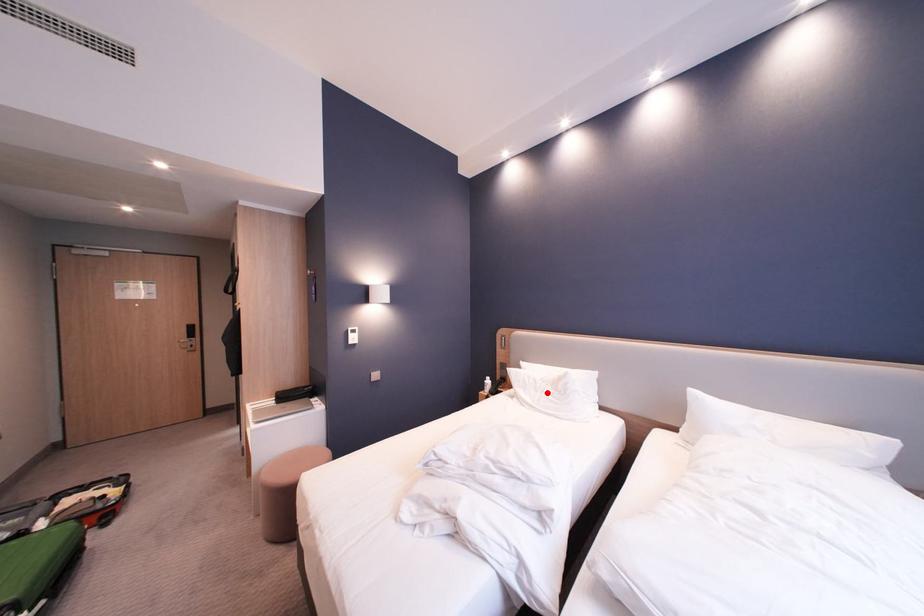
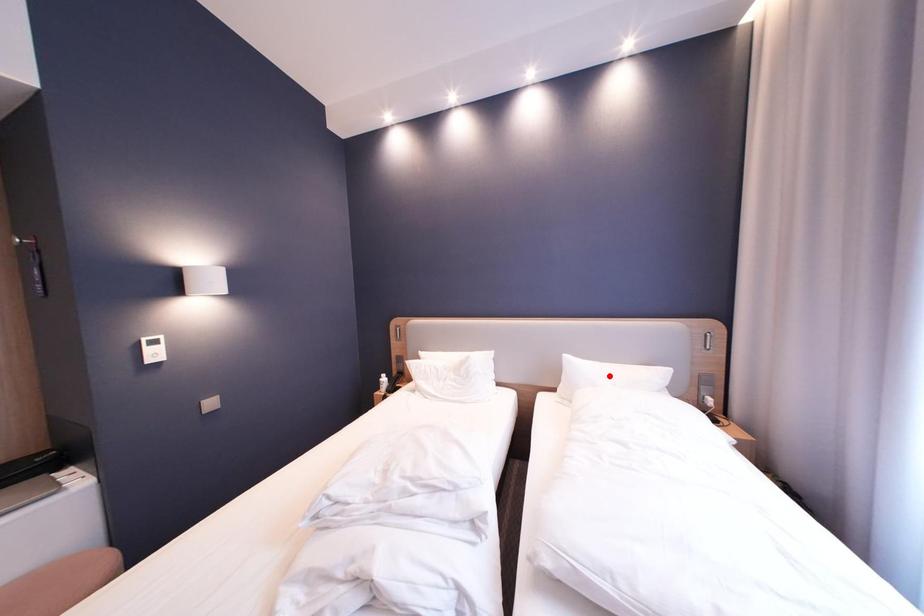
I am providing you with two images of the same scene from different viewpoints. A red point is marked on the first image and another point is marked on the second image. Is the red point in image1 aligned with the point shown in image2?

No